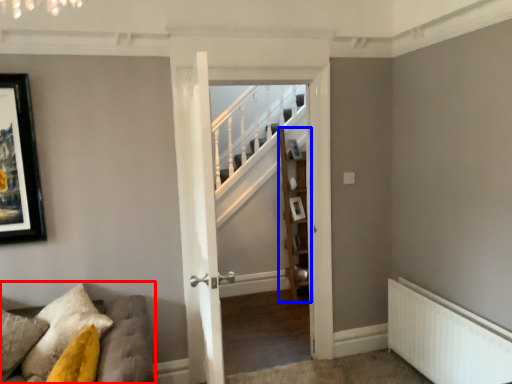
Question: Which object is closer to the camera taking this photo, furniture (highlighted by a red box) or shelf (highlighted by a blue box)?

Choices:
 (A) furniture
 (B) shelf

Answer: (A)